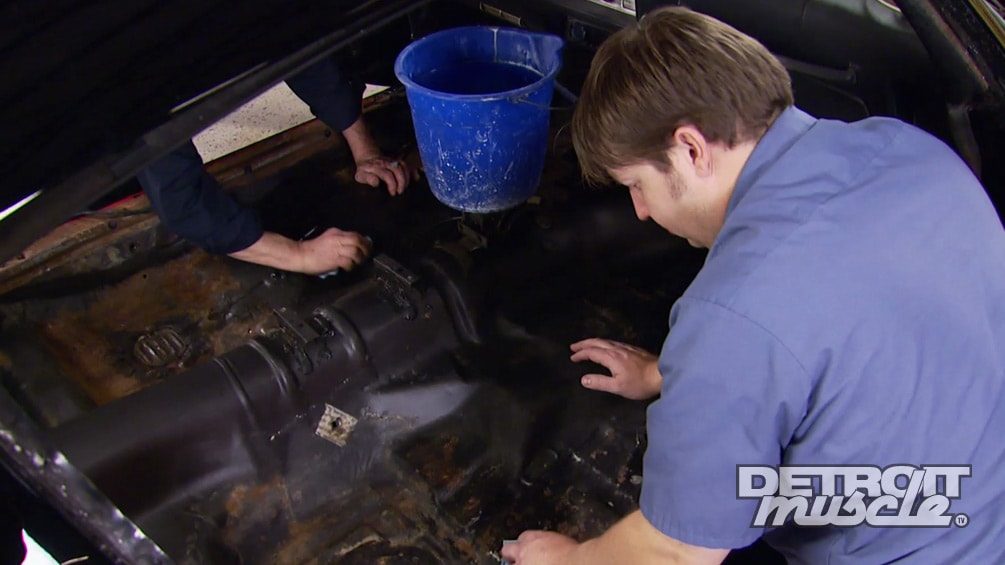
At what (x,y) coordinates should I click in order to perform the action: click on bucket. Please return your answer as a coordinate pair (x, y). The height and width of the screenshot is (565, 1005). Looking at the image, I should click on (500, 133).